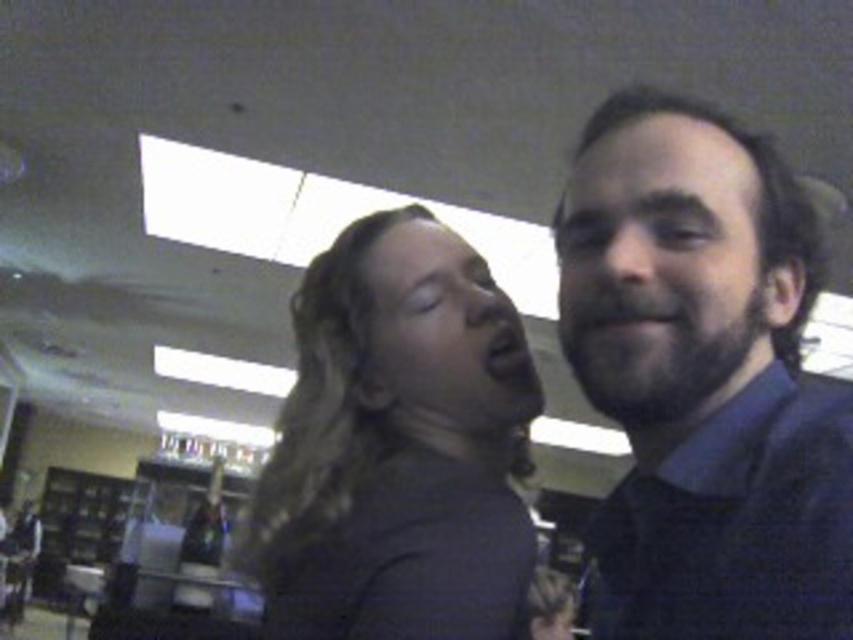
In the scene shown: Please provide the 2D coordinates of the dark blue shirt at right in the image. The coordinates should be in the format of a point with two decimal places, such as point 0.5,0.5.

The dark blue shirt at right is located at point (703, 378).

You are a photographer standing in the library. You want to take a photo of the dark blue shirt at right and dark brown hair at center. The minimum distance your camera requires for clear focus is 15 centimeters. Can you take the photo without moving either subject?

The distance between the dark blue shirt at right and dark brown hair at center is 14.98 centimeters, which is just below the 15 centimeter requirement. Therefore, the camera cannot achieve clear focus without moving the subjects closer together or farther apart.